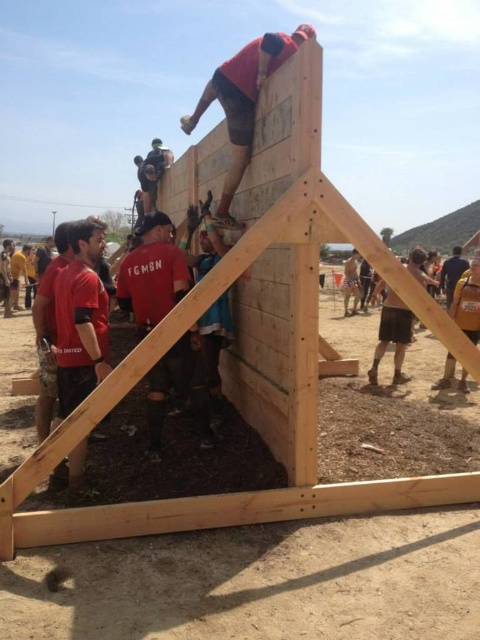
You are standing in the construction area and need to determine which of the two points, point 1 at coordinates point (x=93, y=227) or point 2 at coordinates point (x=12, y=259), is closer to you. Which point is closer?

Point 1 at coordinates point (x=93, y=227) is closer to the viewer than point 2 at coordinates point (x=12, y=259).

Where is the matte red shirt at center located in the image?

The matte red shirt at center is located at point coordinates of approximately 0.430 in the x axis and 0.319 in the y axis.

You are a construction supervisor overseeing the site. You notice two workers, one wearing a matte red shirt at left and another in dark blue jeans at right. Based on their positions, which worker is closer to the ground?

The matte red shirt at left is positioned under dark blue jeans at right, so the matte red shirt at left is closer to the ground.